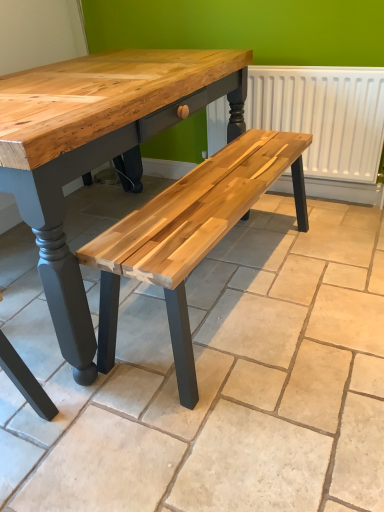
Question: Is the depth of natural wood bench at center greater than that of white matte radiator at upper right?

Choices:
 (A) no
 (B) yes

Answer: (A)

Question: From the image's perspective, is natural wood bench at center under white matte radiator at upper right?

Choices:
 (A) no
 (B) yes

Answer: (B)

Question: Is natural wood bench at center shorter than white matte radiator at upper right?

Choices:
 (A) yes
 (B) no

Answer: (A)

Question: Is the position of natural wood bench at center less distant than that of white matte radiator at upper right?

Choices:
 (A) no
 (B) yes

Answer: (B)

Question: Does natural wood bench at center have a greater height compared to white matte radiator at upper right?

Choices:
 (A) yes
 (B) no

Answer: (B)

Question: From a real-world perspective, is natural wood bench at center physically above white matte radiator at upper right?

Choices:
 (A) no
 (B) yes

Answer: (A)

Question: From the image's perspective, would you say white matte radiator at upper right is positioned over natural wood bench at center?

Choices:
 (A) no
 (B) yes

Answer: (B)

Question: Could you tell me if white matte radiator at upper right is turned towards natural wood bench at center?

Choices:
 (A) yes
 (B) no

Answer: (A)

Question: Would you say white matte radiator at upper right is outside natural wood bench at center?

Choices:
 (A) no
 (B) yes

Answer: (B)

Question: Considering the relative sizes of white matte radiator at upper right and natural wood bench at center in the image provided, is white matte radiator at upper right bigger than natural wood bench at center?

Choices:
 (A) yes
 (B) no

Answer: (B)

Question: Is white matte radiator at upper right behind natural wood bench at center?

Choices:
 (A) yes
 (B) no

Answer: (A)

Question: Does white matte radiator at upper right appear on the left side of natural wood bench at center?

Choices:
 (A) yes
 (B) no

Answer: (B)

Question: Looking at their shapes, would you say white matte radiator at upper right is wider or thinner than natural wood bench at center?

Choices:
 (A) wide
 (B) thin

Answer: (B)